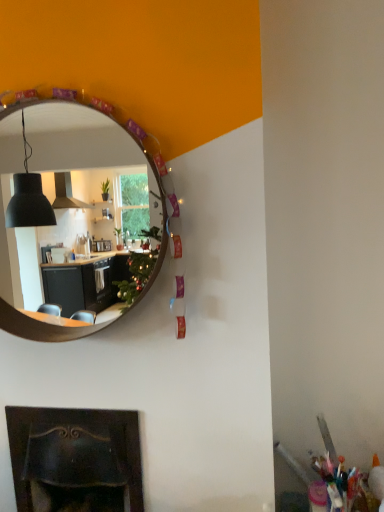
Question: From a real-world perspective, is wooden mirror at upper center physically located above or below dark brown wood fireplace at lower left?

Choices:
 (A) below
 (B) above

Answer: (B)

Question: In the image, is wooden mirror at upper center positioned in front of or behind dark brown wood fireplace at lower left?

Choices:
 (A) front
 (B) behind

Answer: (A)

Question: Is point (122, 276) positioned closer to the camera than point (57, 419)?

Choices:
 (A) farther
 (B) closer

Answer: (A)

Question: Considering the positions of dark brown wood fireplace at lower left and wooden mirror at upper center in the image, is dark brown wood fireplace at lower left taller or shorter than wooden mirror at upper center?

Choices:
 (A) short
 (B) tall

Answer: (A)

Question: Relative to wooden mirror at upper center, is dark brown wood fireplace at lower left in front or behind?

Choices:
 (A) behind
 (B) front

Answer: (A)

Question: Considering the relative positions of dark brown wood fireplace at lower left and wooden mirror at upper center in the image provided, is dark brown wood fireplace at lower left to the left or to the right of wooden mirror at upper center?

Choices:
 (A) left
 (B) right

Answer: (A)

Question: Would you say dark brown wood fireplace at lower left is inside or outside wooden mirror at upper center?

Choices:
 (A) inside
 (B) outside

Answer: (B)